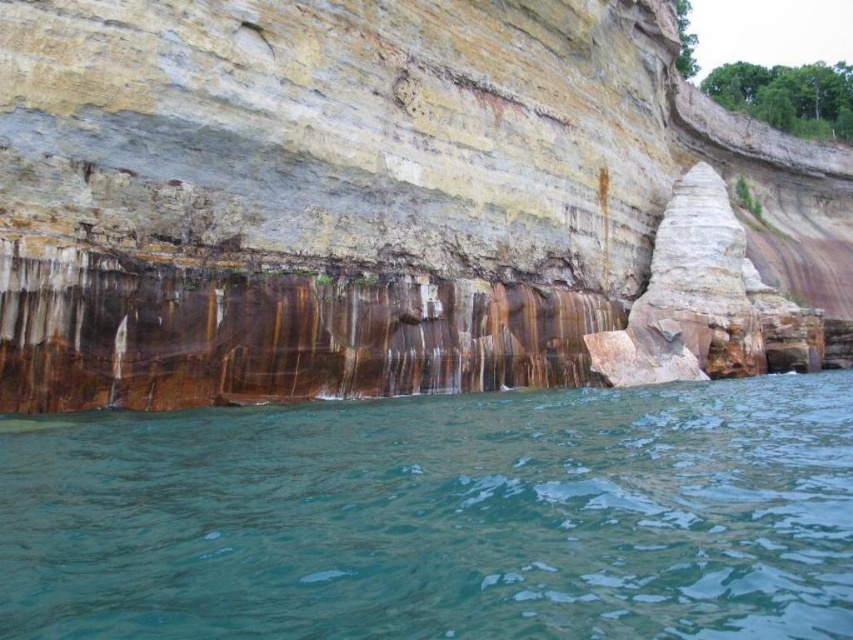
You are a geologist examining the cliff structure. You notice the rusty metallic rock at center and the green translucent water at lower center. Based on their positions, which object is located higher up in the cliff structure?

The rusty metallic rock at center is positioned over the green translucent water at lower center, so it is located higher up in the cliff structure.

You are standing on a cliff overlooking the ocean and see the rusty metallic rock at center and the green translucent water at lower center. Which object is closer to you?

The rusty metallic rock at center is closer to you as it is positioned further to the viewer than the green translucent water at lower center.